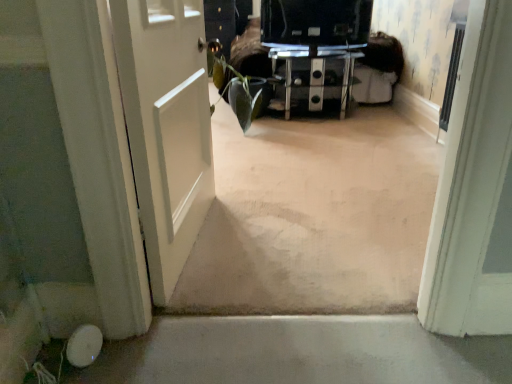
Locate an element on the screen. The width and height of the screenshot is (512, 384). black glossy tv at center is located at coordinates (315, 23).

Which of these two, white matte door at left or black glossy tv at center, is smaller?

black glossy tv at center.

Is white matte door at left situated inside black glossy tv at center or outside?

white matte door at left cannot be found inside black glossy tv at center.

Consider the image. Is white matte door at left taller or shorter than black glossy tv at center?

In the image, white matte door at left appears to be taller than black glossy tv at center.

Is black glossy tv at center bigger or smaller than white matte door at left?

Clearly, black glossy tv at center is smaller in size than white matte door at left.

Identify the location of door below the black glossy tv at center (from a real-world perspective). The width and height of the screenshot is (512, 384). (166, 127).

Can you confirm if black glossy tv at center is positioned to the left of white matte door at left?

In fact, black glossy tv at center is to the right of white matte door at left.

Which is closer, [298,67] or [167,47]?

Point [298,67] appears to be farther away from the viewer than point [167,47].

Where is `furniture lying on the right of white matte door at left`? The width and height of the screenshot is (512, 384). furniture lying on the right of white matte door at left is located at coordinates (314, 79).

From a real-world perspective, which object rests below the other?

In real-world perspective, black glass tv stand at center is lower.

Do you think black glass tv stand at center is within white matte door at left, or outside of it?

black glass tv stand at center is located beyond the bounds of white matte door at left.

Is black glass tv stand at center a part of black glossy tv at center?

No.

In the scene shown: From the image's perspective, between black glossy tv at center and black glass tv stand at center, which one is located above?

black glossy tv at center is shown above in the image.

Which object is thinner, black glossy tv at center or black glass tv stand at center?

black glossy tv at center is thinner.

From a real-world perspective, between black glossy tv at center and black glass tv stand at center, who is vertically lower?

black glass tv stand at center is physically lower.

Is black glass tv stand at center behind black glossy tv at center?

Yes, it is behind black glossy tv at center.

From the image's perspective, would you say black glass tv stand at center is shown under black glossy tv at center?

Yes, from the image's perspective, black glass tv stand at center is below black glossy tv at center.

Is the surface of black glass tv stand at center in direct contact with black glossy tv at center?

There is a gap between black glass tv stand at center and black glossy tv at center.

Considering the relative positions of black glass tv stand at center and black glossy tv at center in the image provided, is black glass tv stand at center to the right of black glossy tv at center from the viewer's perspective?

Yes.

Considering the sizes of objects white matte door at left and black glass tv stand at center in the image provided, who is wider, white matte door at left or black glass tv stand at center?

Wider between the two is black glass tv stand at center.

Is white matte door at left turned away from black glass tv stand at center?

No.

Where is `back above the white matte door at left (from a real-world perspective)`? The width and height of the screenshot is (512, 384). back above the white matte door at left (from a real-world perspective) is located at coordinates (315, 23).

At what (x,y) coordinates should I click in order to perform the action: click on the back located behind the white matte door at left. Please return your answer as a coordinate pair (x, y). This screenshot has width=512, height=384. Looking at the image, I should click on click(315, 23).

Considering their positions, is black glossy tv at center positioned further to black glass tv stand at center than white matte door at left?

white matte door at left is positioned further to the anchor black glass tv stand at center.

Estimate the real-world distances between objects in this image. Which object is further from black glass tv stand at center, white matte door at left or black glossy tv at center?

white matte door at left lies further to black glass tv stand at center than the other object.

From the image, which object appears to be farther from white matte door at left, black glass tv stand at center or black glossy tv at center?

The object further to white matte door at left is black glass tv stand at center.

Looking at the image, which one is located closer to white matte door at left, black glossy tv at center or black glass tv stand at center?

black glossy tv at center.

Based on their spatial positions, is white matte door at left or black glass tv stand at center further from black glossy tv at center?

white matte door at left lies further to black glossy tv at center than the other object.

Estimate the real-world distances between objects in this image. Which object is closer to black glossy tv at center, black glass tv stand at center or white matte door at left?

Based on the image, black glass tv stand at center appears to be nearer to black glossy tv at center.

Locate an element on the screen. the back positioned between white matte door at left and black glass tv stand at center from near to far is located at coordinates (315, 23).